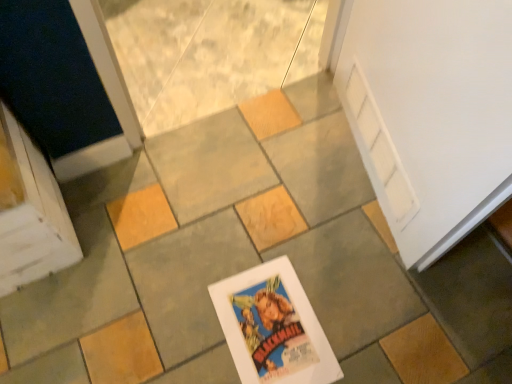
The height and width of the screenshot is (384, 512). Describe the element at coordinates (273, 327) in the screenshot. I see `white paper picture frame at center` at that location.

Measure the distance between point (285, 375) and camera.

They are 36.46 inches apart.

Find the location of a particular element. The width and height of the screenshot is (512, 384). white paper picture frame at center is located at coordinates (273, 327).

Identify the location of white paper picture frame at center. (273, 327).